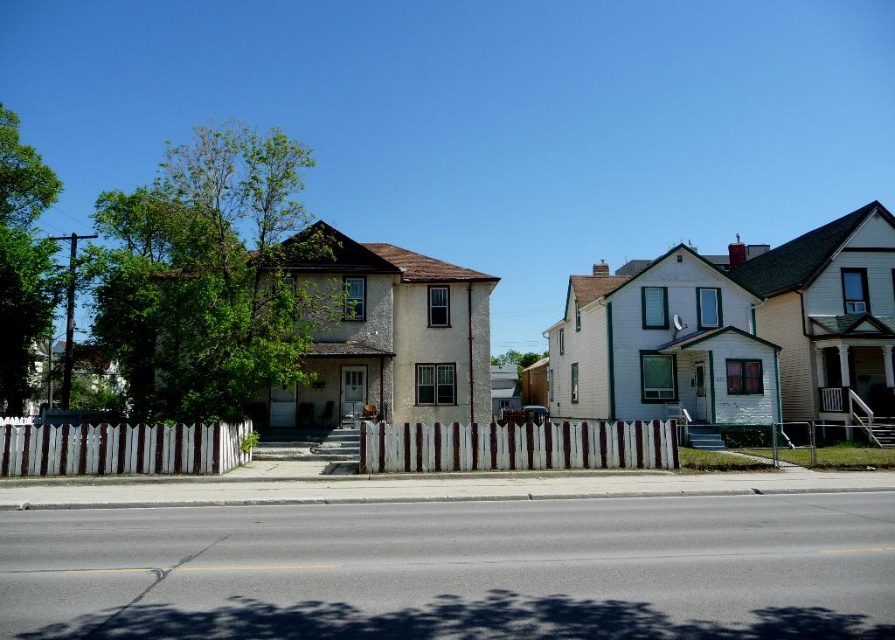
Question: Among these objects, which one is farthest from the camera?

Choices:
 (A) white wood fence at center
 (B) white picket fence at lower left

Answer: (A)

Question: Which point is farther to the camera?

Choices:
 (A) white wood fence at center
 (B) white picket fence at lower left

Answer: (A)

Question: Is white wood fence at center to the left of white picket fence at lower left from the viewer's perspective?

Choices:
 (A) yes
 (B) no

Answer: (B)

Question: Can you confirm if white wood fence at center is wider than white picket fence at lower left?

Choices:
 (A) no
 (B) yes

Answer: (B)

Question: Where is white wood fence at center located in relation to white picket fence at lower left in the image?

Choices:
 (A) left
 (B) right

Answer: (B)

Question: Which of the following is the farthest from the observer?

Choices:
 (A) white wood fence at center
 (B) white picket fence at lower left

Answer: (A)